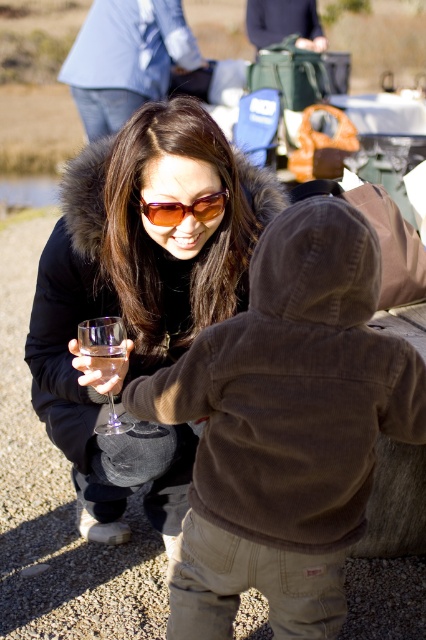
Question: Considering the real-world distances, which object is farthest from the clear glass at lower center?

Choices:
 (A) matte black jacket at center
 (B) clear glass wine glass at lower left
 (C) sunglasses at center

Answer: (A)

Question: Can you confirm if clear glass wine glass at lower left is positioned above clear glass at lower center?

Choices:
 (A) no
 (B) yes

Answer: (A)

Question: Which of the following is the farthest from the observer?

Choices:
 (A) clear glass wine glass at lower left
 (B) clear glass at lower center
 (C) matte black jacket at center
 (D) sunglasses at center

Answer: (D)

Question: Does matte black jacket at center appear over clear glass at lower center?

Choices:
 (A) no
 (B) yes

Answer: (A)

Question: Based on their relative distances, which object is farther from the matte black jacket at center?

Choices:
 (A) clear glass wine glass at lower left
 (B) sunglasses at center
 (C) clear glass at lower center

Answer: (C)

Question: Is matte black jacket at center smaller than clear glass at lower center?

Choices:
 (A) no
 (B) yes

Answer: (A)